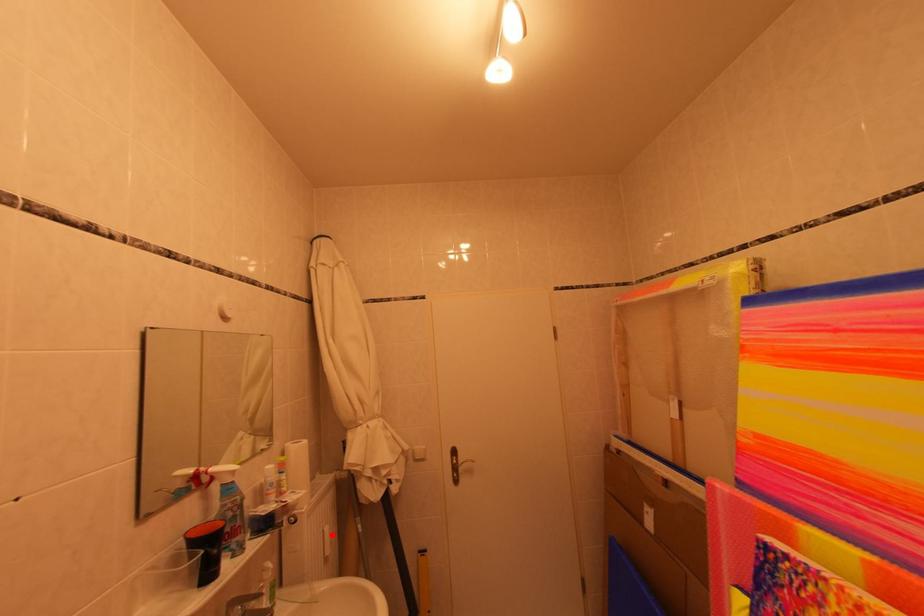
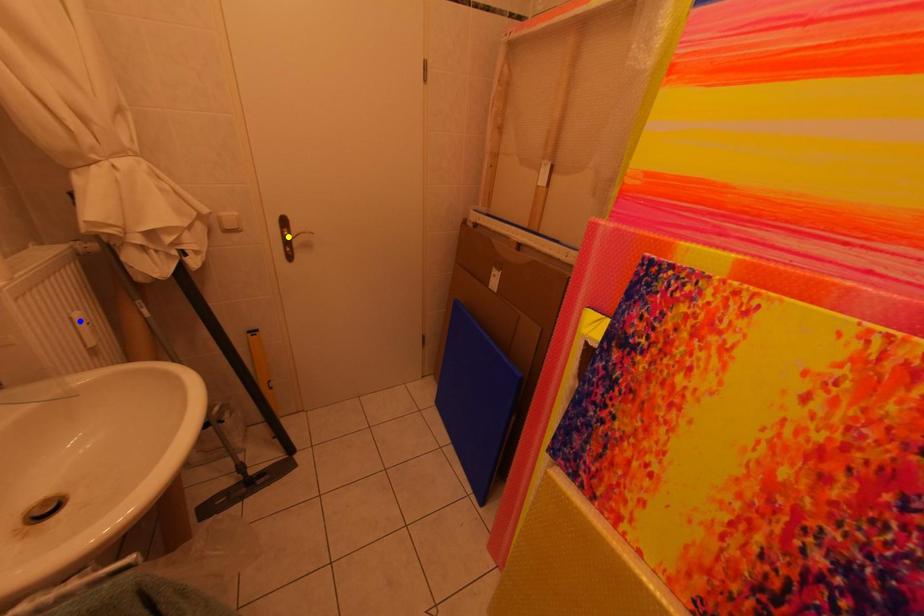
Question: I am providing you with two images of the same scene from different viewpoints. A red point is marked on the first image. You are given multiple points on the second image. Which point in image 2 is actually the same real-world point as the red point in image 1?

Choices:
 (A) blue point
 (B) green point
 (C) yellow point

Answer: (A)